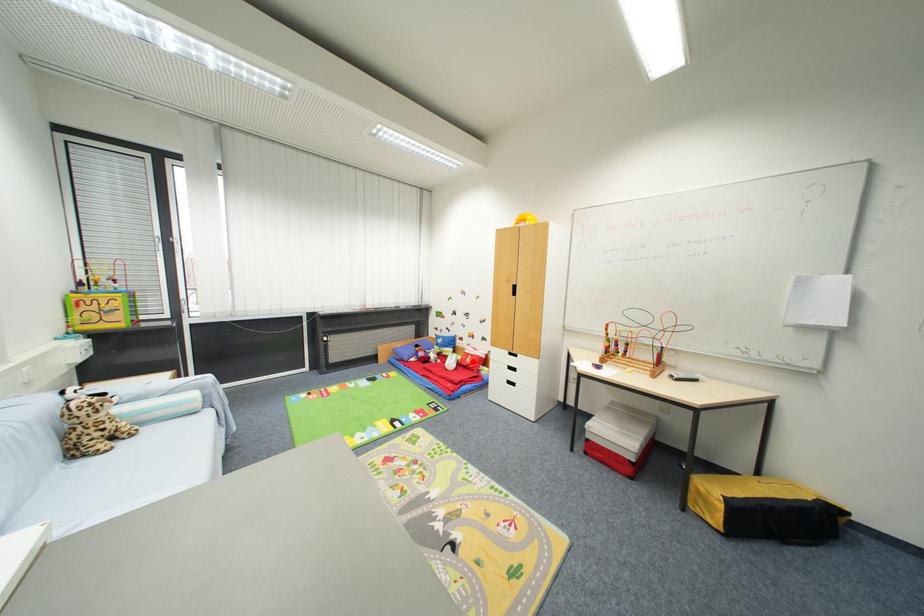
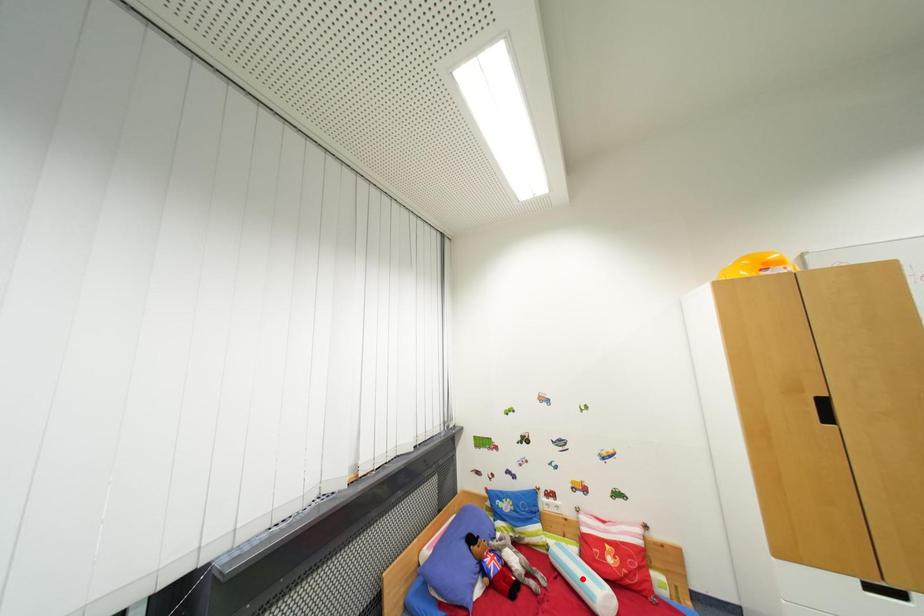
I am providing you with two images of the same scene from different viewpoints. A red point is marked on the first image and another point is marked on the second image. Are the points marked in image1 and image2 representing the same 3D position?

No